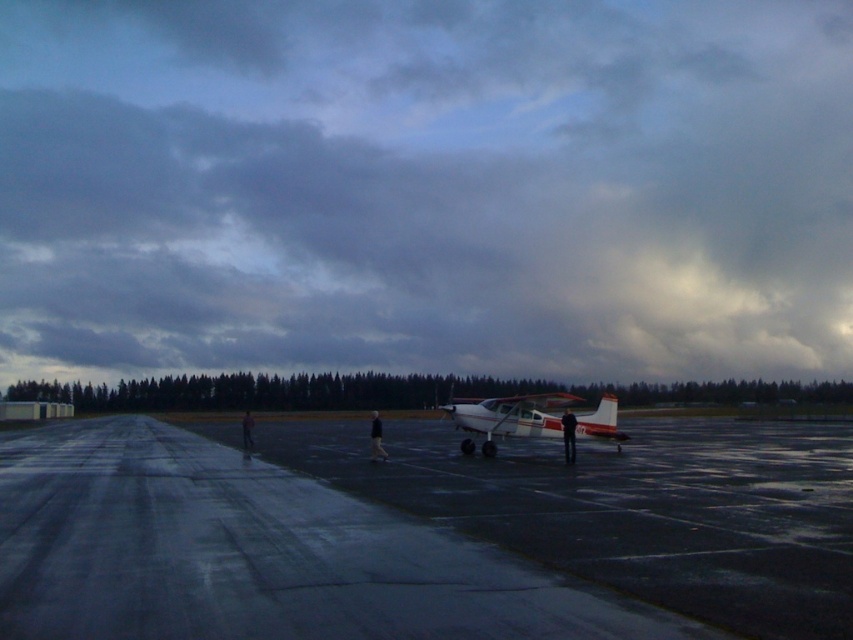
Question: Among these objects, which one is nearest to the camera?

Choices:
 (A) cloudy sky at upper center
 (B) white matte airplane at center
 (C) glossy asphalt tarmac at center

Answer: (C)

Question: Is glossy asphalt tarmac at center below white matte airplane at center?

Choices:
 (A) no
 (B) yes

Answer: (B)

Question: Can you confirm if cloudy sky at upper center is positioned above glossy asphalt tarmac at center?

Choices:
 (A) no
 (B) yes

Answer: (B)

Question: Considering the relative positions of glossy asphalt tarmac at center and white matte airplane at center in the image provided, where is glossy asphalt tarmac at center located with respect to white matte airplane at center?

Choices:
 (A) left
 (B) right

Answer: (A)

Question: Which object is farther from the camera taking this photo?

Choices:
 (A) glossy asphalt tarmac at center
 (B) white matte airplane at center
 (C) cloudy sky at upper center

Answer: (C)

Question: Which object appears closest to the camera in this image?

Choices:
 (A) white matte airplane at center
 (B) cloudy sky at upper center

Answer: (A)